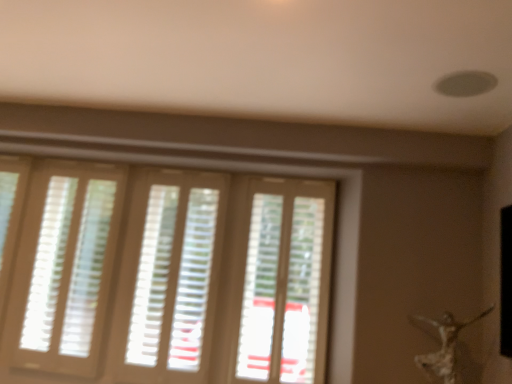
Describe the element at coordinates (445, 346) in the screenshot. I see `silver metallic statue at lower right` at that location.

Locate an element on the screen. white matte blinds at center, which is counted as the second blind, starting from the left is located at coordinates (173, 277).

The height and width of the screenshot is (384, 512). I want to click on silver metallic statue at lower right, so click(x=445, y=346).

Is white matte blinds at center, which is counted as the second blind, starting from the left, completely or partially inside light beige wooden blinds at left, the second blind from the right?

Definitely not — white matte blinds at center, which is counted as the second blind, starting from the left, is not inside light beige wooden blinds at left, the second blind from the right.

Considering the points (97, 272) and (207, 274), which point is behind, point (97, 272) or point (207, 274)?

Point (97, 272)

From the image's perspective, between light beige wooden blinds at left, the second blind from the right, and white matte blinds at center, which is counted as the second blind, starting from the left, who is located below?

white matte blinds at center, which is counted as the second blind, starting from the left.

Does translucent plastic screen door at center turn towards silver metallic statue at lower right?

No, translucent plastic screen door at center is not turned towards silver metallic statue at lower right.

Which object is more forward, translucent plastic screen door at center or silver metallic statue at lower right?

silver metallic statue at lower right is in front.

In terms of height, does translucent plastic screen door at center look taller or shorter compared to light beige wooden blinds at left, marked as the first blind in a left-to-right arrangement?

translucent plastic screen door at center is shorter than light beige wooden blinds at left, marked as the first blind in a left-to-right arrangement.

Between translucent plastic screen door at center and light beige wooden blinds at left, marked as the first blind in a left-to-right arrangement, which one has larger size?

With larger size is light beige wooden blinds at left, marked as the first blind in a left-to-right arrangement.

Considering the relative positions of translucent plastic screen door at center and light beige wooden blinds at left, marked as the first blind in a left-to-right arrangement, in the image provided, is translucent plastic screen door at center behind light beige wooden blinds at left, marked as the first blind in a left-to-right arrangement,?

No, translucent plastic screen door at center is in front of light beige wooden blinds at left, marked as the first blind in a left-to-right arrangement.

This screenshot has height=384, width=512. In order to click on screen door located on the right of light beige wooden blinds at left, marked as the first blind in a left-to-right arrangement in this screenshot , I will do `click(286, 282)`.

Find the location of a particular element. This screenshot has width=512, height=384. the 2nd blind above the silver metallic statue at lower right (from the image's perspective) is located at coordinates pos(68,265).

Which object is thinner, light beige wooden blinds at left, marked as the first blind in a left-to-right arrangement, or silver metallic statue at lower right?

light beige wooden blinds at left, marked as the first blind in a left-to-right arrangement, is thinner.

From the image's perspective, which object appears higher, light beige wooden blinds at left, marked as the first blind in a left-to-right arrangement, or silver metallic statue at lower right?

light beige wooden blinds at left, marked as the first blind in a left-to-right arrangement, appears higher in the image.

Which point is more forward, (96, 237) or (455, 378)?

Positioned in front is point (455, 378).

Is point (425, 355) closer or farther from the camera than point (300, 370)?

Point (425, 355) is closer to the camera than point (300, 370).

Who is bigger, silver metallic statue at lower right or translucent plastic screen door at center?

silver metallic statue at lower right is bigger.

Is silver metallic statue at lower right positioned with its back to translucent plastic screen door at center?

No, silver metallic statue at lower right's orientation is not away from translucent plastic screen door at center.

From a real-world perspective, is silver metallic statue at lower right above or below translucent plastic screen door at center?

silver metallic statue at lower right is situated lower than translucent plastic screen door at center in the real world.

From the image's perspective, is light beige wooden blinds at left, the second blind from the right, under translucent plastic screen door at center?

Incorrect, from the image's perspective, light beige wooden blinds at left, the second blind from the right, is higher than translucent plastic screen door at center.

From a real-world perspective, starting from the translucent plastic screen door at center, which blind is the 1st one below it? Please provide its 2D coordinates.

[(68, 265)]

Considering the points (92, 297) and (237, 354), which point is in front, point (92, 297) or point (237, 354)?

The point (237, 354) is more forward.

Based on the photo, would you say translucent plastic screen door at center is part of light beige wooden blinds at left, marked as the first blind in a left-to-right arrangement,'s contents?

Actually, translucent plastic screen door at center is outside light beige wooden blinds at left, marked as the first blind in a left-to-right arrangement.

From the image's perspective, which one is positioned higher, white matte blinds at center, which ranks as the 1th blind in right-to-left order, or silver metallic statue at lower right?

white matte blinds at center, which ranks as the 1th blind in right-to-left order.

Is silver metallic statue at lower right located within white matte blinds at center, which is counted as the second blind, starting from the left?

No, silver metallic statue at lower right is not a part of white matte blinds at center, which is counted as the second blind, starting from the left.

Which is in front, point (147, 266) or point (444, 356)?

The point (444, 356) is more forward.

Who is bigger, white matte blinds at center, which ranks as the 1th blind in right-to-left order, or silver metallic statue at lower right?

Bigger between the two is white matte blinds at center, which ranks as the 1th blind in right-to-left order.

Find the location of a particular element. blind located behind the white matte blinds at center, which is counted as the second blind, starting from the left is located at coordinates (68, 265).

At what (x,y) coordinates should I click in order to perform the action: click on woman on the right side of translucent plastic screen door at center. Please return your answer as a coordinate pair (x, y). Looking at the image, I should click on (445, 346).

Looking at the image, which one is located closer to silver metallic statue at lower right, translucent plastic screen door at center or light beige wooden blinds at left, the second blind from the right?

translucent plastic screen door at center is positioned closer to the anchor silver metallic statue at lower right.

Based on their spatial positions, is silver metallic statue at lower right or light beige wooden blinds at left, the second blind from the right, closer to translucent plastic screen door at center?

silver metallic statue at lower right is closer to translucent plastic screen door at center.

Which object lies nearer to the anchor point light beige wooden blinds at left, the second blind from the right, translucent plastic screen door at center or white matte blinds at center, which is counted as the second blind, starting from the left?

Among the two, white matte blinds at center, which is counted as the second blind, starting from the left, is located nearer to light beige wooden blinds at left, the second blind from the right.

Which object lies nearer to the anchor point white matte blinds at center, which is counted as the second blind, starting from the left, light beige wooden blinds at left, the second blind from the right, or translucent plastic screen door at center?

light beige wooden blinds at left, the second blind from the right, lies closer to white matte blinds at center, which is counted as the second blind, starting from the left, than the other object.

Looking at this image, based on their spatial positions, is translucent plastic screen door at center or silver metallic statue at lower right further from light beige wooden blinds at left, the second blind from the right?

silver metallic statue at lower right is positioned further to the anchor light beige wooden blinds at left, the second blind from the right.

Estimate the real-world distances between objects in this image. Which object is further from white matte blinds at center, which is counted as the second blind, starting from the left, light beige wooden blinds at left, the second blind from the right, or silver metallic statue at lower right?

The object further to white matte blinds at center, which is counted as the second blind, starting from the left, is silver metallic statue at lower right.

Based on their spatial positions, is white matte blinds at center, which is counted as the second blind, starting from the left, or translucent plastic screen door at center closer to silver metallic statue at lower right?

The object closer to silver metallic statue at lower right is translucent plastic screen door at center.

Looking at the image, which one is located closer to silver metallic statue at lower right, light beige wooden blinds at left, the second blind from the right, or white matte blinds at center, which ranks as the 1th blind in right-to-left order?

The object closer to silver metallic statue at lower right is white matte blinds at center, which ranks as the 1th blind in right-to-left order.

At what (x,y) coordinates should I click in order to perform the action: click on screen door between light beige wooden blinds at left, marked as the first blind in a left-to-right arrangement, and silver metallic statue at lower right. Please return your answer as a coordinate pair (x, y). Looking at the image, I should click on (286, 282).

Identify the location of screen door situated between white matte blinds at center, which is counted as the second blind, starting from the left, and silver metallic statue at lower right from left to right. The image size is (512, 384). (286, 282).

Find the location of a particular element. This screenshot has width=512, height=384. blind between light beige wooden blinds at left, marked as the first blind in a left-to-right arrangement, and silver metallic statue at lower right from left to right is located at coordinates (173, 277).

The width and height of the screenshot is (512, 384). What are the coordinates of `blind situated between light beige wooden blinds at left, marked as the first blind in a left-to-right arrangement, and translucent plastic screen door at center from left to right` in the screenshot? It's located at (173, 277).